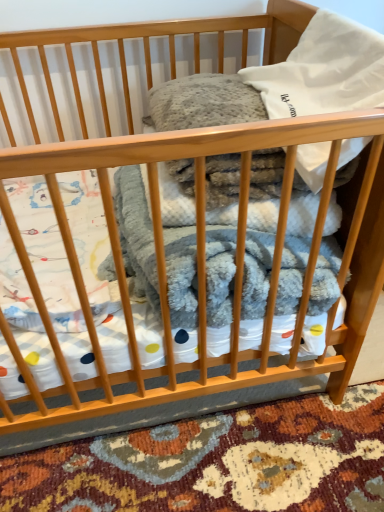
Locate an element on the screen. This screenshot has height=512, width=384. fluffy carpet at lower center is located at coordinates (218, 462).

The height and width of the screenshot is (512, 384). Describe the element at coordinates (218, 462) in the screenshot. I see `fluffy carpet at lower center` at that location.

You are a GUI agent. You are given a task and a screenshot of the screen. Output one action in this format:
    pyautogui.click(x=<x>, y=<y>)
    Task: Click on the fluffy carpet at lower center
    This screenshot has height=512, width=384.
    Given the screenshot: What is the action you would take?
    pyautogui.click(x=218, y=462)